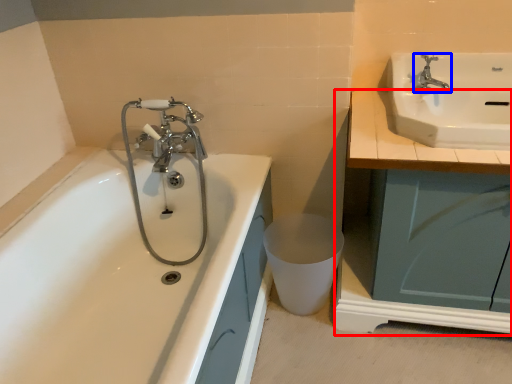
Question: Which object is closer to the camera taking this photo, counter top (highlighted by a red box) or tap (highlighted by a blue box)?

Choices:
 (A) counter top
 (B) tap

Answer: (A)